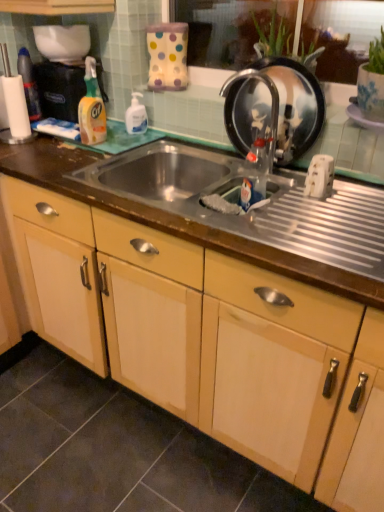
Locate an element on the screen. The height and width of the screenshot is (512, 384). vacant space in front of translucent plastic bottle at upper left, which is the first bottle from top to bottom is located at coordinates (21, 144).